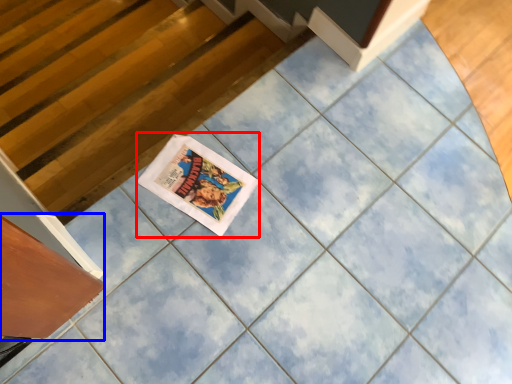
Question: Which object is further to the camera taking this photo, comic book (highlighted by a red box) or drawer (highlighted by a blue box)?

Choices:
 (A) comic book
 (B) drawer

Answer: (A)